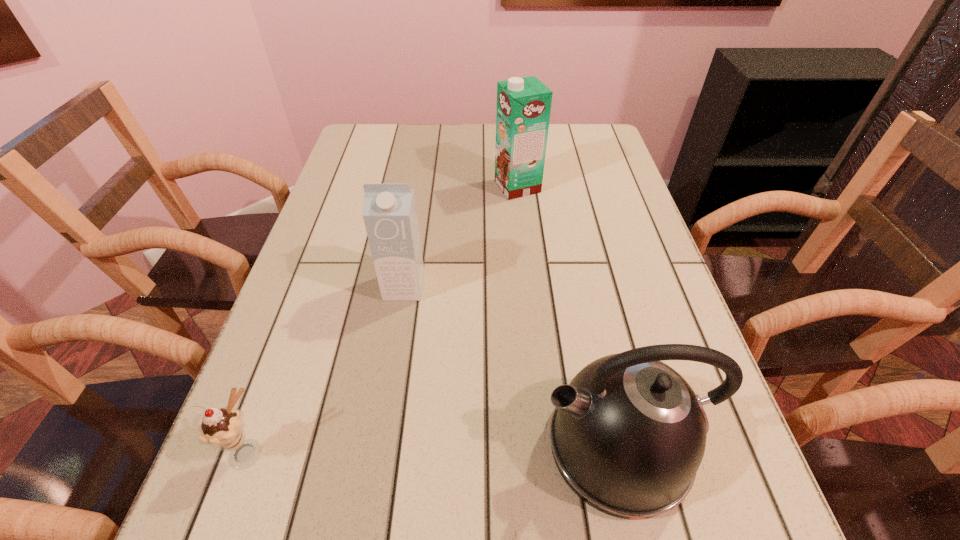
The width and height of the screenshot is (960, 540). Identify the location of free space located on the spout of the kettle. (440, 446).

The width and height of the screenshot is (960, 540). I want to click on free space located on the front label of the second farthest object, so pos(372,489).

Locate an element on the screen. vacant area situated on the back of the shortest object is located at coordinates (285, 347).

Find the location of `object located at the left edge`. object located at the left edge is located at coordinates (223, 428).

Find the location of `object that is at the right edge`. object that is at the right edge is located at coordinates (628, 434).

Find the location of a particular element. blank space at the far edge is located at coordinates (442, 124).

You are a GUI agent. You are given a task and a screenshot of the screen. Output one action in this format:
    pyautogui.click(x=<x>, y=<y>)
    Task: Click on the free space at the near edge of the desktop
    This screenshot has width=960, height=540.
    Given the screenshot: What is the action you would take?
    pyautogui.click(x=610, y=526)

In the image, there is a desktop. What are the coordinates of `free space at the left edge` in the screenshot? It's located at (284, 302).

The height and width of the screenshot is (540, 960). In order to click on free region at the far left corner in this screenshot , I will do `click(381, 141)`.

You are a GUI agent. You are given a task and a screenshot of the screen. Output one action in this format:
    pyautogui.click(x=<x>, y=<y>)
    Task: Click on the blank space at the far right corner of the desktop
    
    Given the screenshot: What is the action you would take?
    pyautogui.click(x=559, y=132)